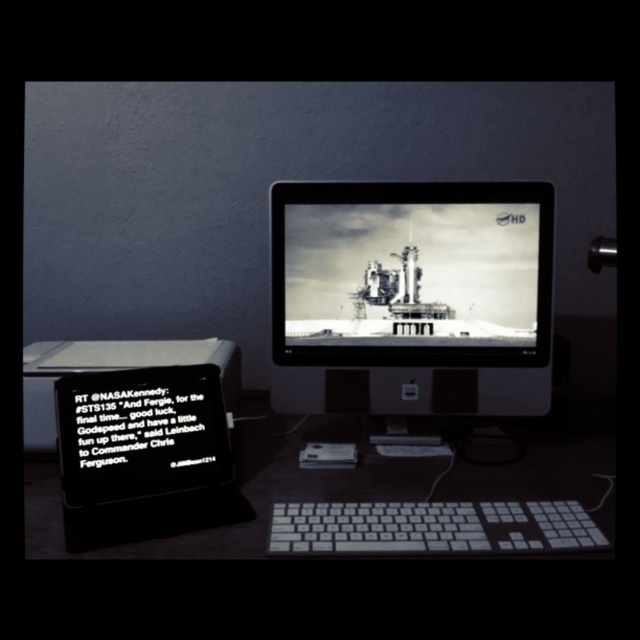
Question: Is white plastic keyboard at center positioned in front of white plastic keyboard at lower center?

Choices:
 (A) no
 (B) yes

Answer: (A)

Question: Among these points, which one is nearest to the camera?

Choices:
 (A) (353, 369)
 (B) (611, 436)

Answer: (A)

Question: In this image, where is white plastic keyboard at center located relative to black matte tablet at lower left?

Choices:
 (A) left
 (B) right

Answer: (B)

Question: Which of these objects is positioned farthest from the white plastic keyboard at lower center?

Choices:
 (A) white plastic keyboard at center
 (B) black matte tablet at lower left
 (C) black glossy monitor at center

Answer: (C)

Question: Can you confirm if white plastic keyboard at center is thinner than black matte tablet at lower left?

Choices:
 (A) yes
 (B) no

Answer: (B)

Question: Estimate the real-world distances between objects in this image. Which object is farther from the black glossy monitor at center?

Choices:
 (A) white plastic keyboard at center
 (B) black matte tablet at lower left

Answer: (B)